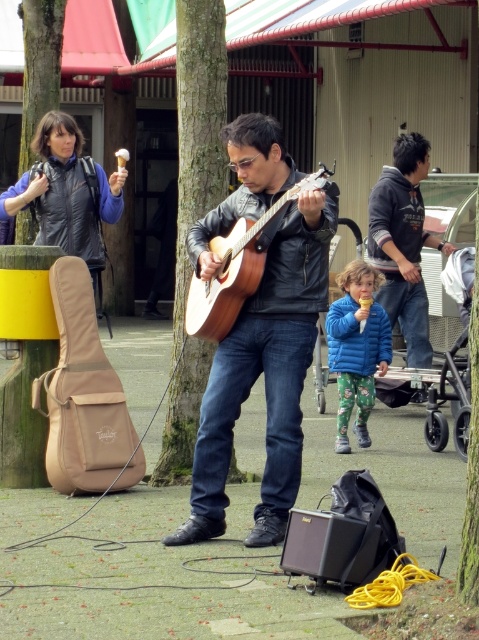
Who is positioned more to the right, wooden acoustic guitar at center or blue fleece jacket at center?

blue fleece jacket at center

Is wooden acoustic guitar at center taller than blue fleece jacket at center?

Indeed, wooden acoustic guitar at center has a greater height compared to blue fleece jacket at center.

Is point (271, 419) positioned before point (358, 404)?

Yes, point (271, 419) is closer to viewer.

You are a GUI agent. You are given a task and a screenshot of the screen. Output one action in this format:
    pyautogui.click(x=<x>, y=<y>)
    Task: Click on the wooden acoustic guitar at center
    The width and height of the screenshot is (479, 640).
    Given the screenshot: What is the action you would take?
    pyautogui.click(x=264, y=372)

Can you confirm if blue fleece jacket at center is thinner than green rough bark tree at upper left?

Yes.

Is point (380, 307) closer to camera compared to point (37, 4)?

Yes, point (380, 307) is closer to viewer.

The height and width of the screenshot is (640, 479). I want to click on blue fleece jacket at center, so click(x=356, y=348).

Between dark gray hoodie at upper right and green rough bark tree at upper left, which one is positioned lower?

dark gray hoodie at upper right is below.

Does dark gray hoodie at upper right appear under green rough bark tree at upper left?

Correct, dark gray hoodie at upper right is located below green rough bark tree at upper left.

Is point (398, 198) positioned after point (33, 24)?

That is False.

Find the location of a particular element. The height and width of the screenshot is (640, 479). dark gray hoodie at upper right is located at coordinates (403, 243).